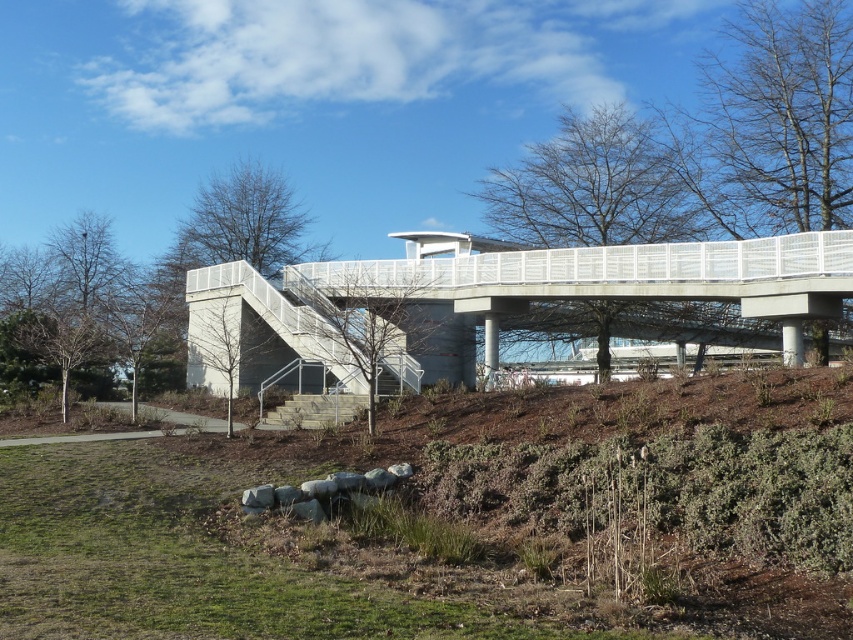
You are standing in the park and want to take a photo of the white metallic pedestrian bridge at center. If your camera can focus up to 20 meters, will it be able to capture the bridge clearly?

The white metallic pedestrian bridge at center is 18.44 meters away from the camera, which is within the camera focus range of 20 meters. Therefore, the camera can capture the bridge clearly.

You are standing at the base of the staircase leading up to the bridge and want to reach the point that is closer to you. Which point should you head towards, point [509,296] or point [310,397]?

You should head towards point [310,397] because it is closer to you than point [509,296], which is further away.

You are a delivery person carrying a large carton box that is 1.2 meters wide. You need to cross the white metallic pedestrian bridge at center. Can you safely pass through the bridge while avoiding the wooden stairs at center?

The white metallic pedestrian bridge at center might be wider than wooden stairs at center. If the bridge is indeed wider, then the 1.2 meters wide carton box can pass safely by staying away from the wooden stairs at center. However, without exact measurements, this is an approximation.